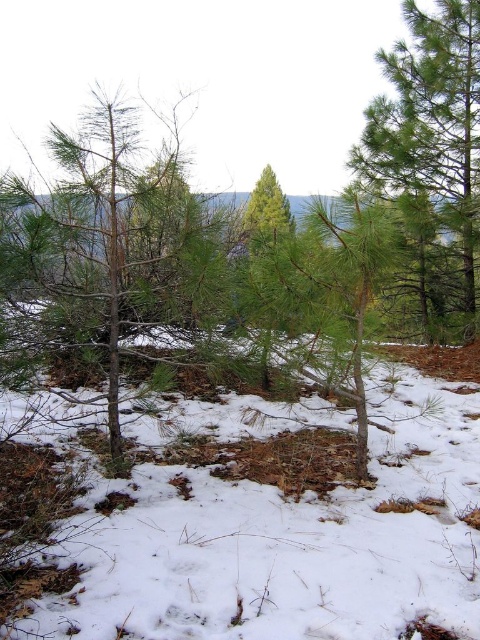
Question: Estimate the real-world distances between objects in this image. Which object is farther from the green needle-like at center?

Choices:
 (A) white fluffy snow at center
 (B) green needle-like tree at center

Answer: (B)

Question: Estimate the real-world distances between objects in this image. Which object is farther from the green needle-like at center?

Choices:
 (A) green needle-like tree at center
 (B) white fluffy snow at center

Answer: (A)

Question: Is green needle-like tree at center bigger than green needle-like at center?

Choices:
 (A) yes
 (B) no

Answer: (B)

Question: Does white fluffy snow at center appear on the left side of green needle-like tree at center?

Choices:
 (A) no
 (B) yes

Answer: (A)

Question: Does white fluffy snow at center lie behind green needle-like tree at center?

Choices:
 (A) no
 (B) yes

Answer: (A)

Question: Which point is closer to the camera?

Choices:
 (A) (73, 256)
 (B) (278, 508)

Answer: (B)